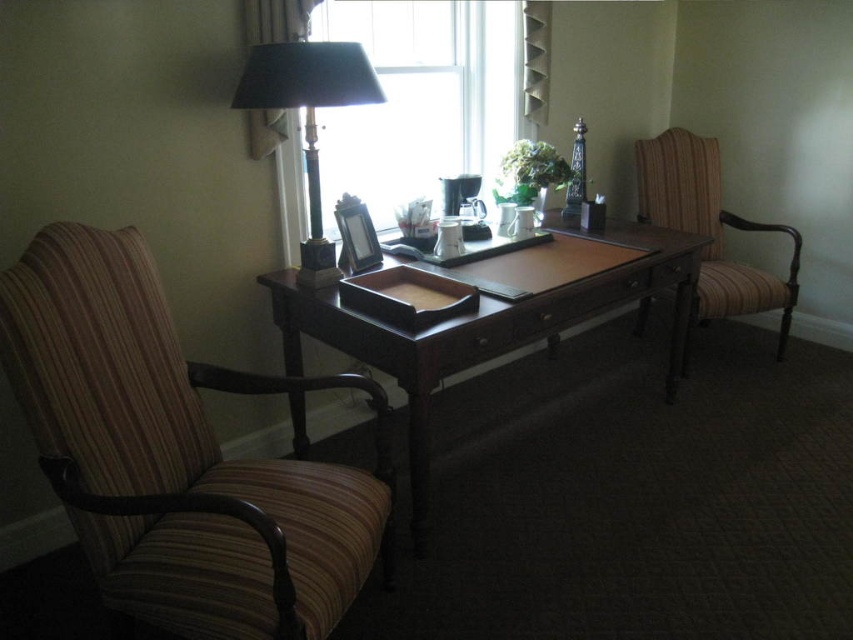
You are organizing a small meeting in this study. You need to place a name tag for a guest on the desk so it is closer to the black marble lamp at upper left than to the dark wood desk at center. Where should you place the name tag?

Place the name tag on the dark wood desk at center closer to the black marble lamp at upper left side so it is nearer to the lamp than the desk center.

You are organizing a small meeting in the study. You need to seat two people. The dark wood desk at center is currently occupied with items. Can the striped fabric armchair at right accommodate both attendees comfortably?

The dark wood desk at center is larger in size than the striped fabric armchair at right. Since the desk is occupied, the striped fabric armchair at right may not comfortably fit two people as it is smaller in size.

You are a delivery person who needs to place a rectangular package that is 30 inches long between the dark wood desk at center and the striped fabric armchair at right. Is there enough space to fit the package between them?

The dark wood desk at center is 29.50 inches from the striped fabric armchair at right. Since the package is 30 inches long, it is slightly longer than the available space. Therefore, the package cannot fit between them.